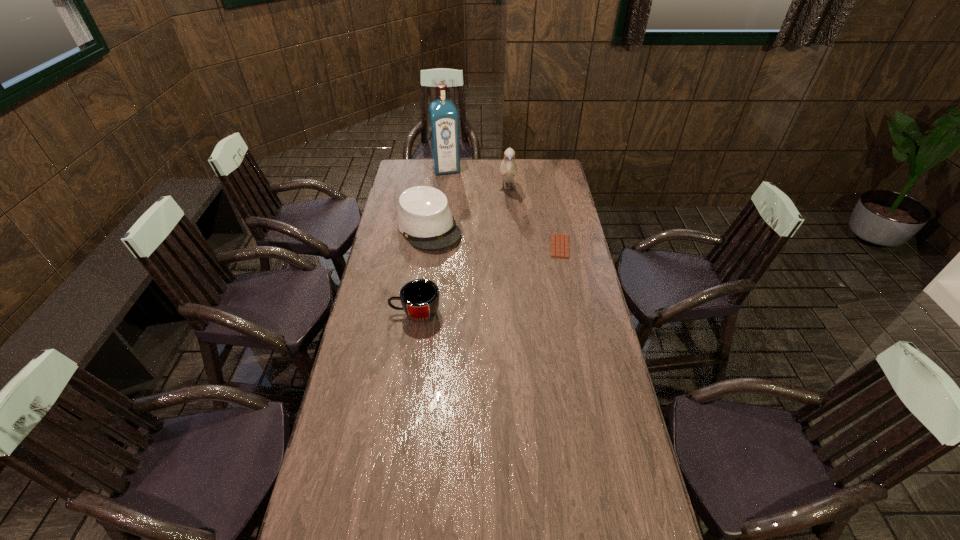
Where is `vacant region located 0.060m on the front of the shortest object`? The width and height of the screenshot is (960, 540). vacant region located 0.060m on the front of the shortest object is located at coordinates (564, 268).

This screenshot has width=960, height=540. I want to click on vacant point located on the flat label side of the liquor, so click(458, 206).

Find the location of `vacant space located on the flat label side of the liquor`. vacant space located on the flat label side of the liquor is located at coordinates (457, 204).

Locate an element on the screen. The width and height of the screenshot is (960, 540). vacant space located 0.380m on the flat label side of the liquor is located at coordinates (461, 217).

I want to click on free region located at the beak of the second tallest object, so click(x=511, y=246).

Identify the location of free space located at the beak of the second tallest object. The width and height of the screenshot is (960, 540). (511, 255).

This screenshot has width=960, height=540. I want to click on vacant space situated at the beak of the second tallest object, so click(511, 252).

Where is `vacant area situated on the front-facing side of the third shortest object`? Image resolution: width=960 pixels, height=540 pixels. vacant area situated on the front-facing side of the third shortest object is located at coordinates (454, 265).

The image size is (960, 540). I want to click on free space located on the front-facing side of the third shortest object, so point(472,290).

Locate an element on the screen. Image resolution: width=960 pixels, height=540 pixels. free location located 0.270m on the front-facing side of the third shortest object is located at coordinates (471, 288).